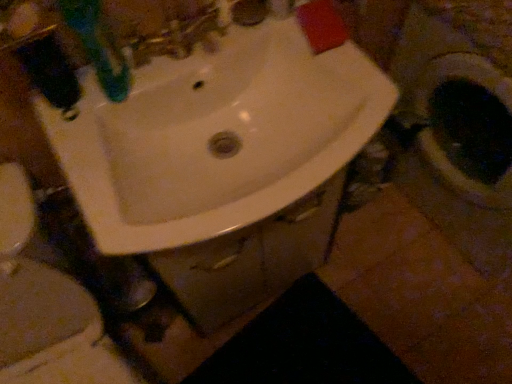
At what (x,y) coordinates should I click in order to perform the action: click on free spot behind black matte rug at lower center. Please return your answer as a coordinate pair (x, y). The image size is (512, 384). Looking at the image, I should click on (345, 274).